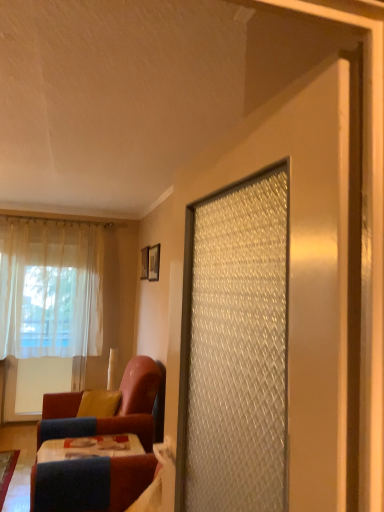
Question: From a real-world perspective, is wooden picture frame at upper center, acting as the second picture frame starting from the front, located beneath wooden table at lower left?

Choices:
 (A) no
 (B) yes

Answer: (A)

Question: From the image's perspective, is wooden picture frame at upper center, which is the first picture frame from left to right, on wooden table at lower left?

Choices:
 (A) no
 (B) yes

Answer: (B)

Question: From the image's perspective, would you say wooden picture frame at upper center, which is counted as the second picture frame, starting from the right, is shown under wooden table at lower left?

Choices:
 (A) no
 (B) yes

Answer: (A)

Question: Is wooden table at lower left surrounded by wooden picture frame at upper center, which is the first picture frame from left to right?

Choices:
 (A) no
 (B) yes

Answer: (A)

Question: Is wooden picture frame at upper center, acting as the second picture frame starting from the front, oriented towards wooden table at lower left?

Choices:
 (A) yes
 (B) no

Answer: (B)

Question: In terms of size, does matte black picture frame at upper center, placed as the 1th picture frame when sorted from front to back, appear bigger or smaller than velvet-like red chair at lower left?

Choices:
 (A) big
 (B) small

Answer: (B)

Question: From a real-world perspective, is matte black picture frame at upper center, positioned as the second picture frame in back-to-front order, positioned above or below velvet-like red chair at lower left?

Choices:
 (A) above
 (B) below

Answer: (A)

Question: From the image's perspective, is matte black picture frame at upper center, the second picture frame viewed from the left, located above or below velvet-like red chair at lower left?

Choices:
 (A) below
 (B) above

Answer: (B)

Question: Is matte black picture frame at upper center, positioned as the second picture frame in back-to-front order, situated inside velvet-like red chair at lower left or outside?

Choices:
 (A) outside
 (B) inside

Answer: (A)

Question: Visually, is wooden picture frame at upper center, which is the first picture frame from left to right, positioned to the left or to the right of yellow fabric pillow at lower left?

Choices:
 (A) left
 (B) right

Answer: (B)

Question: Considering the positions of point (142, 273) and point (87, 393), is point (142, 273) closer or farther from the camera than point (87, 393)?

Choices:
 (A) closer
 (B) farther

Answer: (B)

Question: From the image's perspective, is wooden picture frame at upper center, which is counted as the second picture frame, starting from the right, above or below yellow fabric pillow at lower left?

Choices:
 (A) above
 (B) below

Answer: (A)

Question: Is wooden picture frame at upper center, acting as the second picture frame starting from the front, situated inside yellow fabric pillow at lower left or outside?

Choices:
 (A) outside
 (B) inside

Answer: (A)

Question: Based on their sizes in the image, would you say wooden table at lower left is bigger or smaller than white sheer curtain at left?

Choices:
 (A) big
 (B) small

Answer: (B)

Question: In terms of height, does wooden table at lower left look taller or shorter compared to white sheer curtain at left?

Choices:
 (A) tall
 (B) short

Answer: (B)